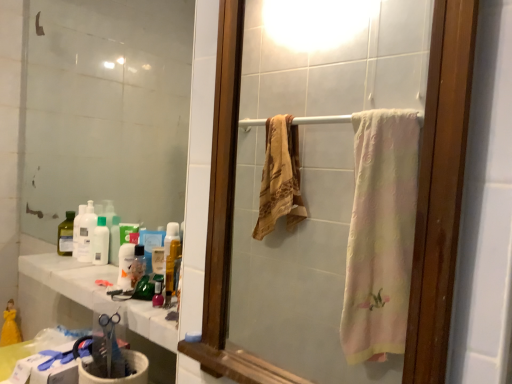
Question: In terms of height, does translucent plastic bottle at lower center look taller or shorter compared to white glossy countertop at lower left?

Choices:
 (A) short
 (B) tall

Answer: (B)

Question: Considering the positions of translucent plastic bottle at lower center and white glossy countertop at lower left in the image, is translucent plastic bottle at lower center bigger or smaller than white glossy countertop at lower left?

Choices:
 (A) small
 (B) big

Answer: (A)

Question: Which is nearer to the translucent plastic bottle at lower center?

Choices:
 (A) clear glass mirror at upper left, acting as the first mirror starting from the back
 (B) wooden frame mirror at center, the 1th mirror in the front-to-back sequence
 (C) translucent plastic bottle at left, placed as the 2th cleaning product when sorted from left to right
 (D) translucent plastic bottle at left, arranged as the first cleaning product when viewed from the left
 (E) white glossy countertop at lower left

Answer: (E)

Question: Estimate the real-world distances between objects in this image. Which object is farther from the translucent plastic bottle at left, which is counted as the 1th cleaning product, starting from the right?

Choices:
 (A) translucent plastic bottle at lower center
 (B) clear glass mirror at upper left, which is the second mirror in front-to-back order
 (C) translucent plastic bottle at center
 (D) translucent plastic bottle at left, arranged as the first cleaning product when viewed from the left
 (E) white glossy countertop at lower left

Answer: (B)